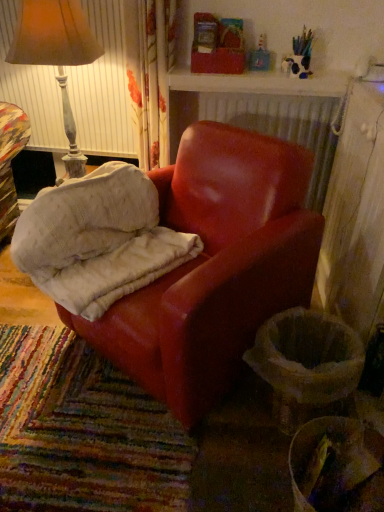
Question: Considering the relative sizes of matte brown lampshade at upper left and suede-like red armchair at center in the image provided, is matte brown lampshade at upper left wider than suede-like red armchair at center?

Choices:
 (A) yes
 (B) no

Answer: (B)

Question: Considering the relative sizes of matte brown lampshade at upper left and suede-like red armchair at center in the image provided, is matte brown lampshade at upper left shorter than suede-like red armchair at center?

Choices:
 (A) no
 (B) yes

Answer: (A)

Question: Could you tell me if matte brown lampshade at upper left is facing suede-like red armchair at center?

Choices:
 (A) no
 (B) yes

Answer: (B)

Question: Is suede-like red armchair at center inside matte brown lampshade at upper left?

Choices:
 (A) yes
 (B) no

Answer: (B)

Question: From a real-world perspective, is matte brown lampshade at upper left physically above suede-like red armchair at center?

Choices:
 (A) no
 (B) yes

Answer: (B)

Question: From a real-world perspective, is matte leather chair at center positioned above or below suede-like red armchair at center?

Choices:
 (A) below
 (B) above

Answer: (A)

Question: From the image's perspective, is matte leather chair at center located above or below suede-like red armchair at center?

Choices:
 (A) below
 (B) above

Answer: (A)

Question: Which is correct: matte leather chair at center is inside suede-like red armchair at center, or outside of it?

Choices:
 (A) outside
 (B) inside

Answer: (A)

Question: Is matte leather chair at center bigger or smaller than suede-like red armchair at center?

Choices:
 (A) small
 (B) big

Answer: (B)

Question: From a real-world perspective, is suede-like red armchair at center physically located above or below matte leather chair at center?

Choices:
 (A) above
 (B) below

Answer: (A)

Question: Is suede-like red armchair at center wider or thinner than matte leather chair at center?

Choices:
 (A) thin
 (B) wide

Answer: (A)

Question: Do you think suede-like red armchair at center is within matte leather chair at center, or outside of it?

Choices:
 (A) outside
 (B) inside

Answer: (B)

Question: Would you say suede-like red armchair at center is to the left or to the right of matte leather chair at center in the picture?

Choices:
 (A) right
 (B) left

Answer: (B)

Question: Is matte brown lampshade at upper left situated inside suede-like red armchair at center or outside?

Choices:
 (A) outside
 (B) inside

Answer: (A)

Question: Does point (18, 51) appear closer or farther from the camera than point (77, 200)?

Choices:
 (A) farther
 (B) closer

Answer: (A)